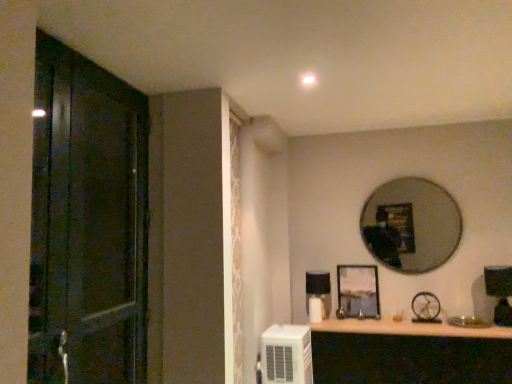
Question: Is silver metallic mirror at upper right taller or shorter than metallic silver clock at upper right?

Choices:
 (A) short
 (B) tall

Answer: (B)

Question: Would you say silver metallic mirror at upper right is inside or outside metallic silver clock at upper right?

Choices:
 (A) inside
 (B) outside

Answer: (B)

Question: Estimate the real-world distances between objects in this image. Which object is farther from the dark wood door at left?

Choices:
 (A) white plastic air conditioner at lower right
 (B) wooden shelf at lower center
 (C) metallic silver clock at upper right
 (D) metallic silver picture frame at center
 (E) silver metallic mirror at upper right

Answer: (C)

Question: Which object is positioned farthest from the metallic silver clock at upper right?

Choices:
 (A) silver metallic mirror at upper right
 (B) metallic silver picture frame at center
 (C) white plastic air conditioner at lower right
 (D) wooden shelf at lower center
 (E) dark wood door at left

Answer: (E)